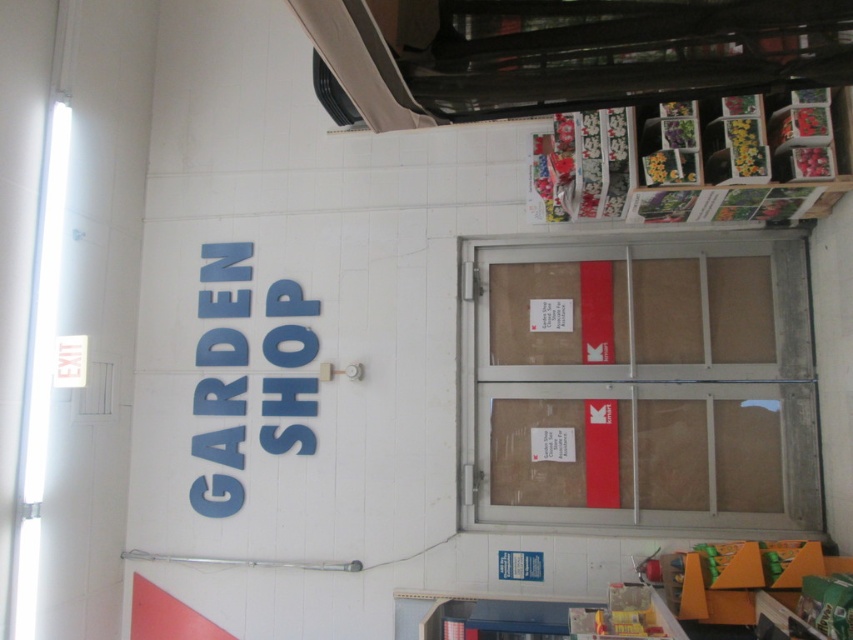
You are standing at the entrance of the GARDEN SHOP and want to locate the brown cardboard door at center. According to the coordinates provided, where exactly is it positioned?

The brown cardboard door at center is positioned at coordinates point (639,385).

You are a delivery person who needs to enter the store through the doors. The doors have a red stripe. Which object, the brown cardboard door at center or the wooden shelves at upper right, is bigger in size?

The brown cardboard door at center is larger in size than the wooden shelves at upper right.

You are a delivery person standing at the entrance of the GARDEN SHOP. You need to locate the black plastic exhaust hood at upper center. According to the store layout, where exactly is it positioned?

The black plastic exhaust hood at upper center is positioned at point (561,52).